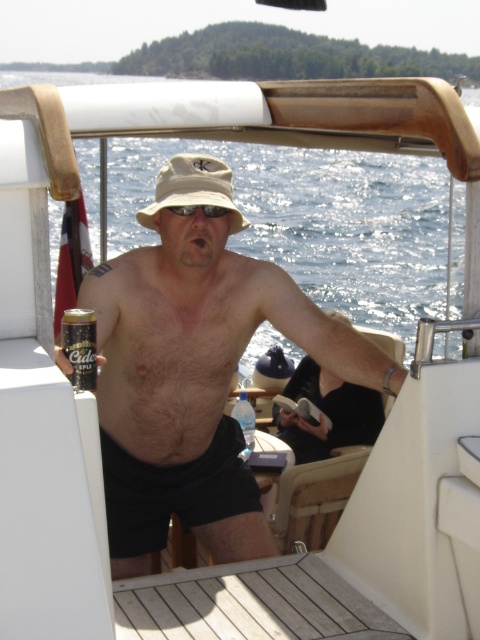
Which of these two, black cotton shorts at center or gold metallic can at lower left, stands shorter?

gold metallic can at lower left is shorter.

Who is taller, black cotton shorts at center or gold metallic can at lower left?

With more height is black cotton shorts at center.

Who is more forward, (191, 481) or (62, 326)?

Point (62, 326) is more forward.

You are a GUI agent. You are given a task and a screenshot of the screen. Output one action in this format:
    pyautogui.click(x=<x>, y=<y>)
    Task: Click on the black cotton shorts at center
    Image resolution: width=480 pixels, height=640 pixels.
    Given the screenshot: What is the action you would take?
    pyautogui.click(x=173, y=492)

Does matte beige bucket hat at center appear under hairy skin at center?

Correct, matte beige bucket hat at center is located below hairy skin at center.

This screenshot has height=640, width=480. I want to click on matte beige bucket hat at center, so click(194, 371).

Find the location of a particular element. matte beige bucket hat at center is located at coordinates (194, 371).

Does hairy skin at center have a smaller size compared to black cotton shorts at center?

No.

Which is in front, point (148, 291) or point (216, 490)?

Point (148, 291)

Between point (95, 288) and point (243, 476), which one is positioned in front?

Positioned in front is point (95, 288).

Where is `hairy skin at center`? Image resolution: width=480 pixels, height=640 pixels. hairy skin at center is located at coordinates (171, 342).